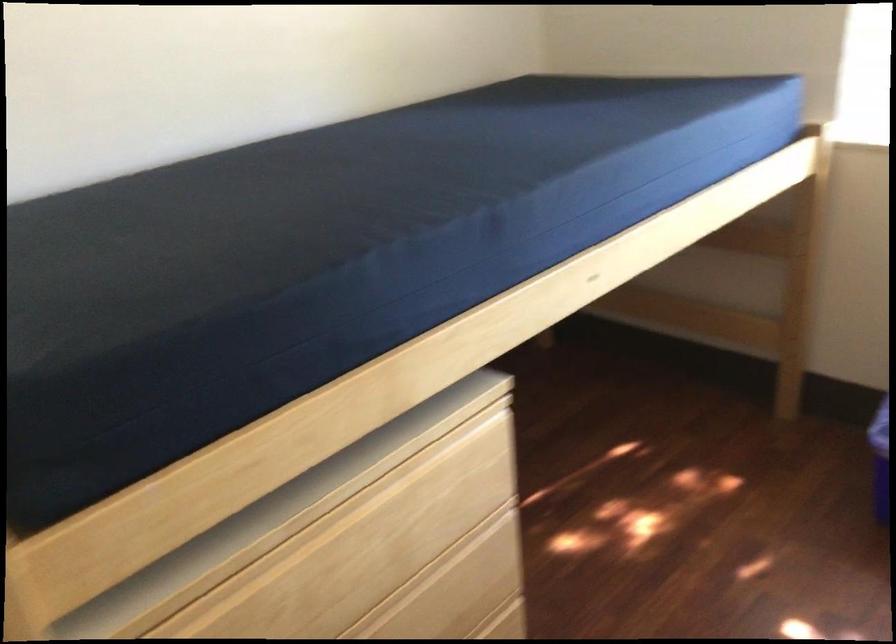
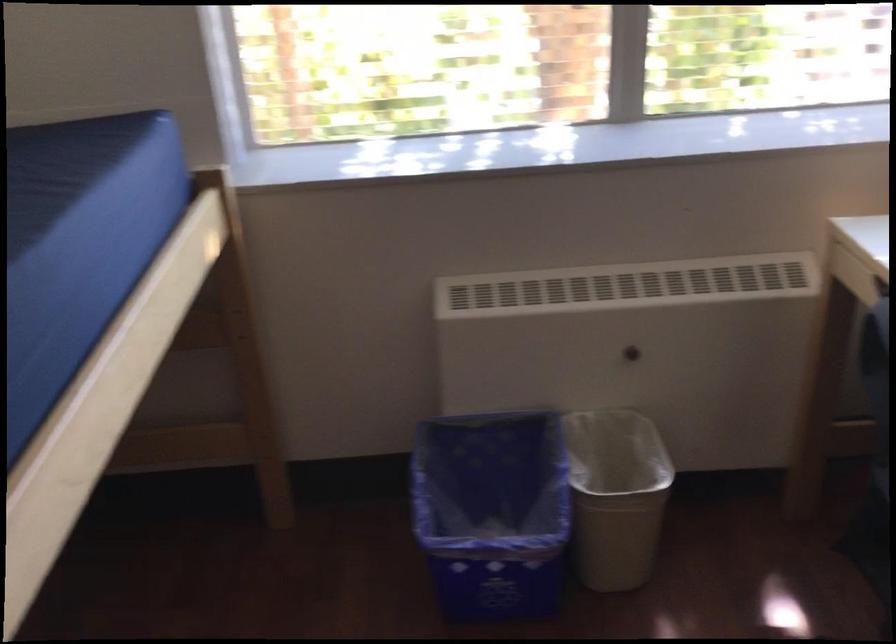
Question: How did the camera likely rotate?

Choices:
 (A) Left
 (B) Right
 (C) Up
 (D) Down

Answer: (B)